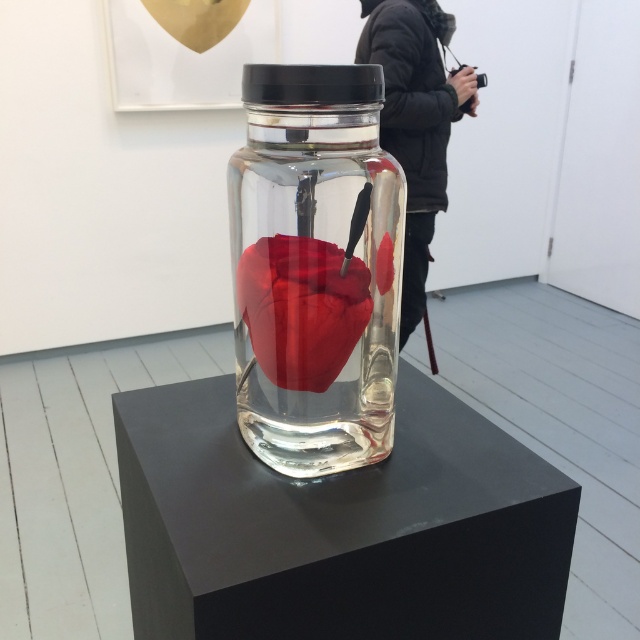
Question: Which object appears closest to the camera in this image?

Choices:
 (A) black jacket at center
 (B) transparent glass jar at center

Answer: (B)

Question: Can you confirm if transparent glass jar at center is wider than matte red heart at center?

Choices:
 (A) no
 (B) yes

Answer: (B)

Question: Is transparent glass jar at center bigger than black jacket at center?

Choices:
 (A) no
 (B) yes

Answer: (A)

Question: Which object is closer to the camera taking this photo?

Choices:
 (A) matte red heart at center
 (B) transparent glass jar at center

Answer: (B)

Question: Which point is farther to the camera?

Choices:
 (A) (433, 83)
 (B) (307, 147)

Answer: (A)

Question: Does black jacket at center have a greater width compared to matte red heart at center?

Choices:
 (A) yes
 (B) no

Answer: (A)